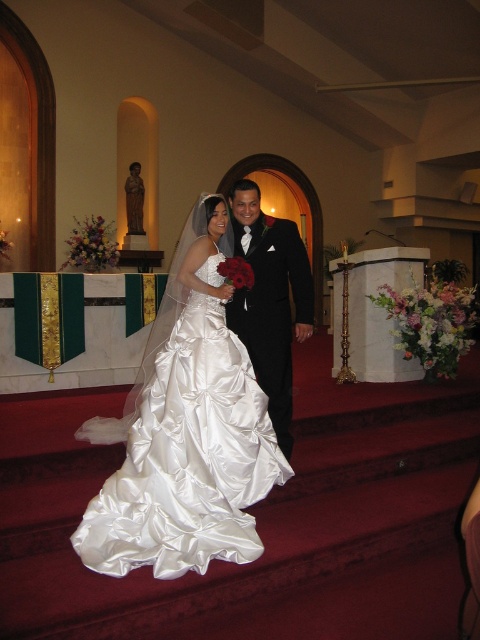
You are a photographer at the wedding and want to capture a photo of the satin dress at center and the shiny black suit at center. Based on their positions, which one should you focus on first if you are moving from left to right along the aisle?

The satin dress at center is to the left of the shiny black suit at center, so you should focus on the satin dress at center first as you move from left to right along the aisle.

You are standing in the church and want to take a photo of the point at coordinates (162,508). The camera you are using has a minimum focus distance of 2.5 meters. Will the camera be able to focus on the point?

The point at coordinates (162,508) is 2.69 meters away from the camera. Since the minimum focus distance is 2.5 meters, the camera can focus on the point as it is beyond the minimum required distance.